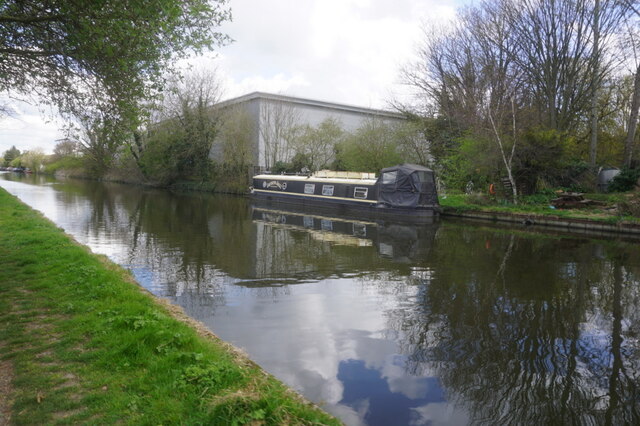
Where is `windows`? windows is located at coordinates (306, 186), (324, 186), (363, 192).